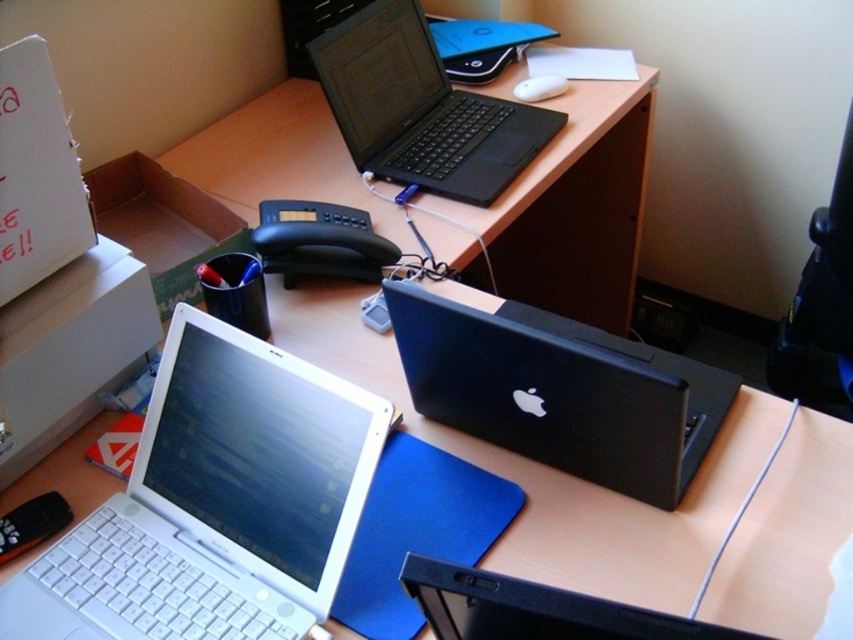
Question: Which object appears farthest from the camera in this image?

Choices:
 (A) white cardboard box at upper left
 (B) black matte laptop at upper center
 (C) black matte laptop at center
 (D) black matte laptop at lower center

Answer: (B)

Question: Which point is farther to the camera?

Choices:
 (A) (354, 24)
 (B) (824, 282)
 (C) (408, 371)

Answer: (A)

Question: Can you confirm if black matte laptop at lower center is positioned to the right of black plastic monitor at right?

Choices:
 (A) no
 (B) yes

Answer: (A)

Question: Considering the relative positions of black matte laptop at upper center and cardboard box at left in the image provided, where is black matte laptop at upper center located with respect to cardboard box at left?

Choices:
 (A) left
 (B) right

Answer: (B)

Question: Which point is farther to the camera?

Choices:
 (A) (473, 593)
 (B) (260, 577)
 (C) (817, 346)

Answer: (C)

Question: Is white plastic laptop at lower left closer to camera compared to black plastic monitor at right?

Choices:
 (A) yes
 (B) no

Answer: (A)